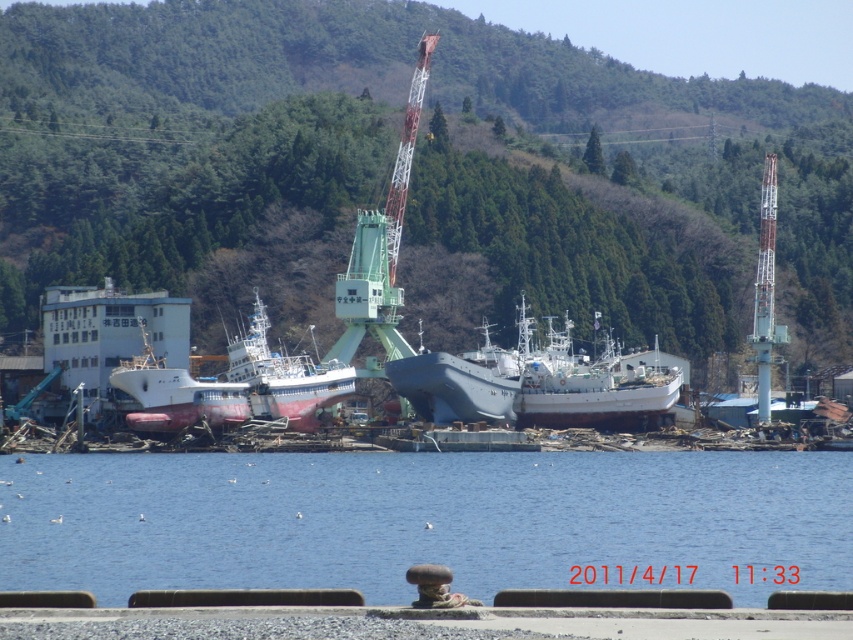
Who is taller, green forested hillside at upper center or blue water at center?

green forested hillside at upper center

Does green forested hillside at upper center appear over blue water at center?

Correct, green forested hillside at upper center is located above blue water at center.

Does point (416, 184) come behind point (61, 552)?

Yes, it is behind point (61, 552).

The image size is (853, 640). I want to click on green forested hillside at upper center, so click(410, 173).

What do you see at coordinates (535, 384) in the screenshot? I see `blue metallic ship at center` at bounding box center [535, 384].

Can you confirm if blue metallic ship at center is positioned below white matte boat at center?

Actually, blue metallic ship at center is above white matte boat at center.

Locate an element on the screen. The height and width of the screenshot is (640, 853). blue metallic ship at center is located at coordinates 535,384.

Looking at this image, does blue water at center have a lesser height compared to white matte boat at center?

Correct, blue water at center is not as tall as white matte boat at center.

Can you confirm if blue water at center is smaller than white matte boat at center?

Incorrect, blue water at center is not smaller in size than white matte boat at center.

I want to click on blue water at center, so click(426, 520).